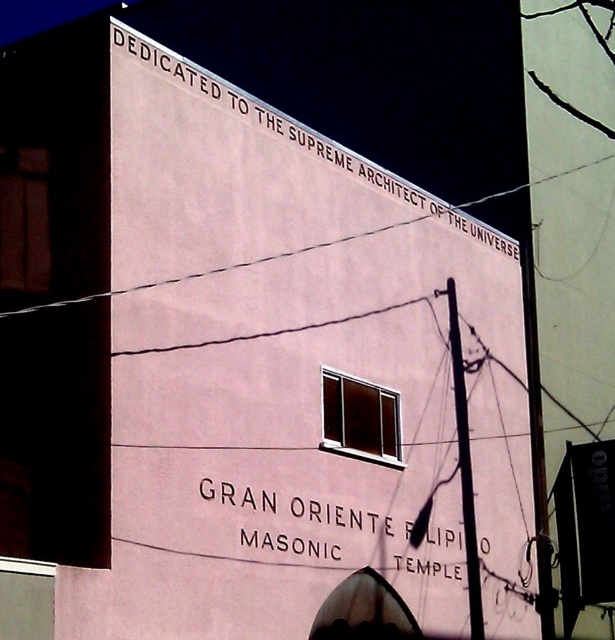
Is black text at upper center below white painted text at center?

No, black text at upper center is not below white painted text at center.

Does point (121, 26) lie in front of point (472, 513)?

That is True.

Locate an element on the screen. This screenshot has height=640, width=615. black text at upper center is located at coordinates (292, 132).